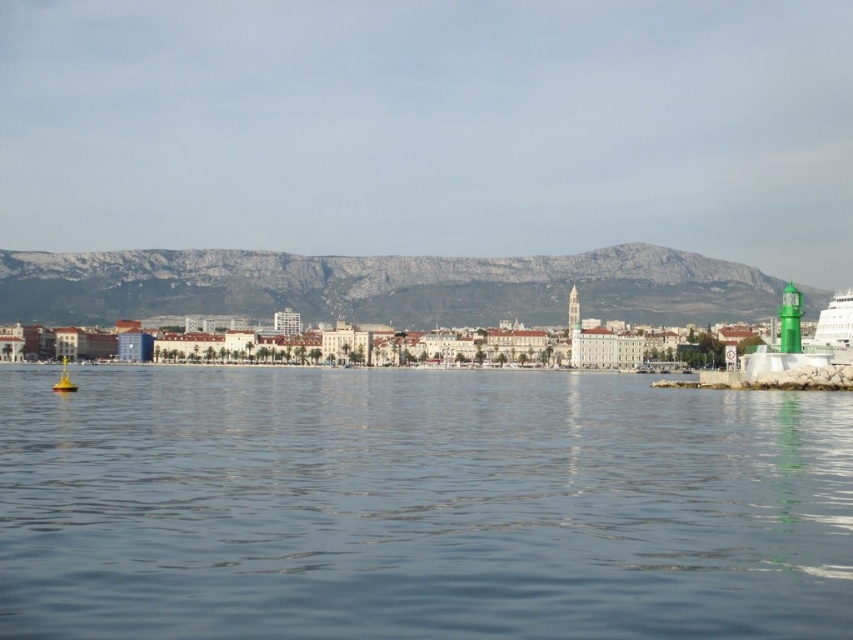
Is blue water at center below yellow matte buoy at lower left?

Indeed, blue water at center is positioned under yellow matte buoy at lower left.

Which is behind, point (746, 550) or point (61, 358)?

Point (61, 358)

Which is behind, point (306, 636) or point (68, 388)?

The point (68, 388) is more distant.

Find the location of a particular element. The image size is (853, 640). blue water at center is located at coordinates (418, 506).

Is gray rocky mountain at upper center bigger than yellow matte buoy at lower left?

Yes, gray rocky mountain at upper center is bigger than yellow matte buoy at lower left.

Is point (25, 320) closer to camera compared to point (67, 372)?

No.

Measure the distance between gray rocky mountain at upper center and camera.

gray rocky mountain at upper center and camera are 454.12 feet apart from each other.

At what (x,y) coordinates should I click in order to perform the action: click on gray rocky mountain at upper center. Please return your answer as a coordinate pair (x, y). Looking at the image, I should click on pyautogui.click(x=381, y=285).

Which is more to the left, blue water at center or gray rocky mountain at upper center?

From the viewer's perspective, blue water at center appears more on the left side.

In the scene shown: Who is lower down, blue water at center or gray rocky mountain at upper center?

blue water at center is lower down.

Identify the location of blue water at center. (418, 506).

Locate an element on the screen. The width and height of the screenshot is (853, 640). blue water at center is located at coordinates (418, 506).